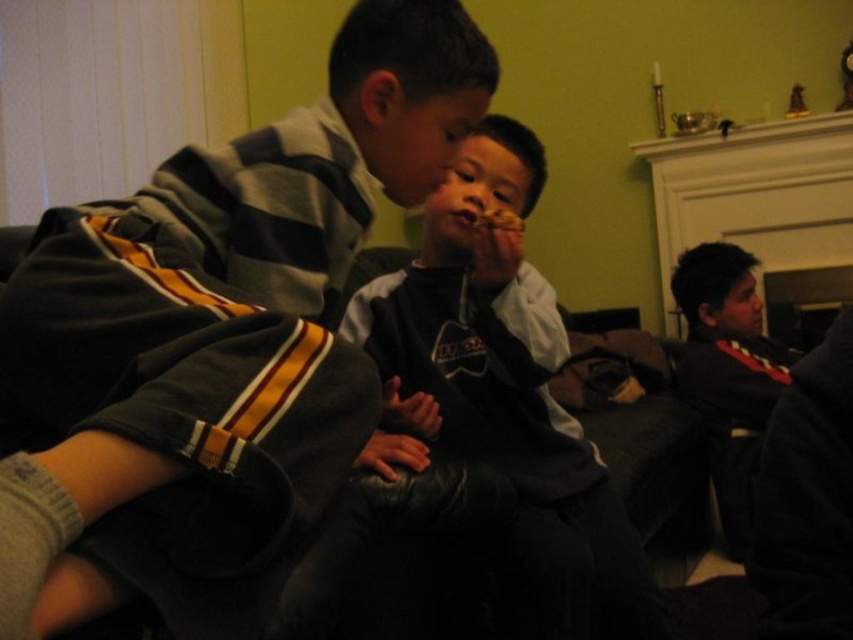
Is matte gray hoodie at center wider than dark gray hoodie at center?

Yes, matte gray hoodie at center is wider than dark gray hoodie at center.

Does matte gray hoodie at center appear on the right side of dark gray hoodie at center?

In fact, matte gray hoodie at center is to the left of dark gray hoodie at center.

Is point (363, 438) positioned before point (453, 246)?

Yes, point (363, 438) is in front of point (453, 246).

Locate an element on the screen. This screenshot has height=640, width=853. matte gray hoodie at center is located at coordinates (213, 342).

Looking at this image, does matte gray hoodie at center have a larger size compared to matte brown cookie at center?

Yes, matte gray hoodie at center is bigger than matte brown cookie at center.

Is matte gray hoodie at center shorter than matte brown cookie at center?

In fact, matte gray hoodie at center may be taller than matte brown cookie at center.

Is point (41, 388) behind point (514, 220)?

No, it is in front of (514, 220).

Locate an element on the screen. The width and height of the screenshot is (853, 640). matte gray hoodie at center is located at coordinates [213, 342].

Between matte gray hoodie at center and dark gray sweater at center, which one has less height?

Standing shorter between the two is matte gray hoodie at center.

Locate an element on the screen. The width and height of the screenshot is (853, 640). matte gray hoodie at center is located at coordinates (213, 342).

Find the location of `matte gray hoodie at center`. matte gray hoodie at center is located at coordinates (213, 342).